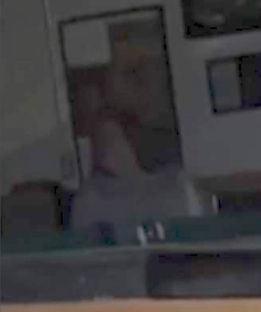
You are a GUI agent. You are given a task and a screenshot of the screen. Output one action in this format:
    pyautogui.click(x=<x>, y=<y>)
    Task: Click on the window
    The height and width of the screenshot is (312, 261).
    Given the screenshot: What is the action you would take?
    pyautogui.click(x=232, y=104)